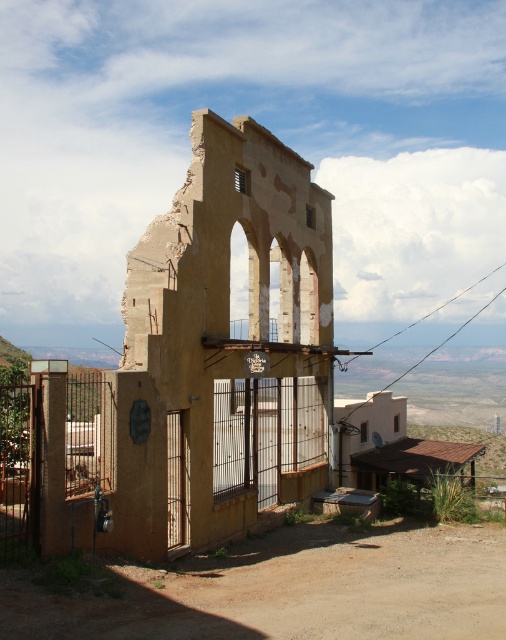
Which of these two, yellow stucco ruins at center or rusty metal gate at lower left, stands shorter?

Standing shorter between the two is rusty metal gate at lower left.

Is yellow stucco ruins at center wider than rusty metal gate at lower left?

No.

Which is behind, point (208, 396) or point (297, 417)?

Positioned behind is point (297, 417).

At what (x,y) coordinates should I click in order to perform the action: click on yellow stucco ruins at center. Please return your answer as a coordinate pair (x, y). This screenshot has width=506, height=640. Looking at the image, I should click on (216, 332).

Which is more to the right, yellow stucco ruins at center or brown wooden gate at left?

yellow stucco ruins at center

How much distance is there between yellow stucco ruins at center and brown wooden gate at left?

A distance of 10.04 feet exists between yellow stucco ruins at center and brown wooden gate at left.

Who is more distant from viewer, (213, 136) or (86, 477)?

Point (213, 136)

The width and height of the screenshot is (506, 640). In order to click on yellow stucco ruins at center in this screenshot , I will do `click(216, 332)`.

Is rusty metal gate at lower left wider than brown wooden gate at left?

Indeed, rusty metal gate at lower left has a greater width compared to brown wooden gate at left.

Does rusty metal gate at lower left have a greater height compared to brown wooden gate at left?

Correct, rusty metal gate at lower left is much taller as brown wooden gate at left.

This screenshot has width=506, height=640. Identify the location of rusty metal gate at lower left. (159, 452).

The height and width of the screenshot is (640, 506). Find the location of `rusty metal gate at lower left`. rusty metal gate at lower left is located at coordinates (159, 452).